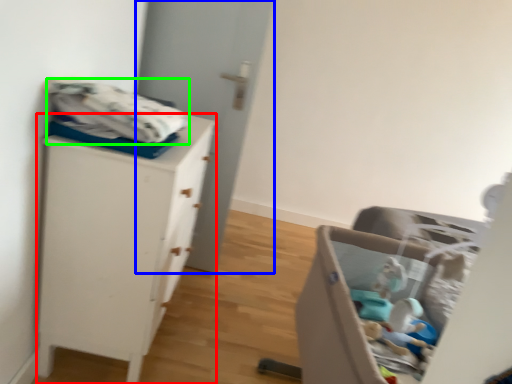
Question: Which is nearer to the chest of drawers (highlighted by a red box)? door (highlighted by a blue box) or baby clothe (highlighted by a green box).

Choices:
 (A) door
 (B) baby clothe

Answer: (B)